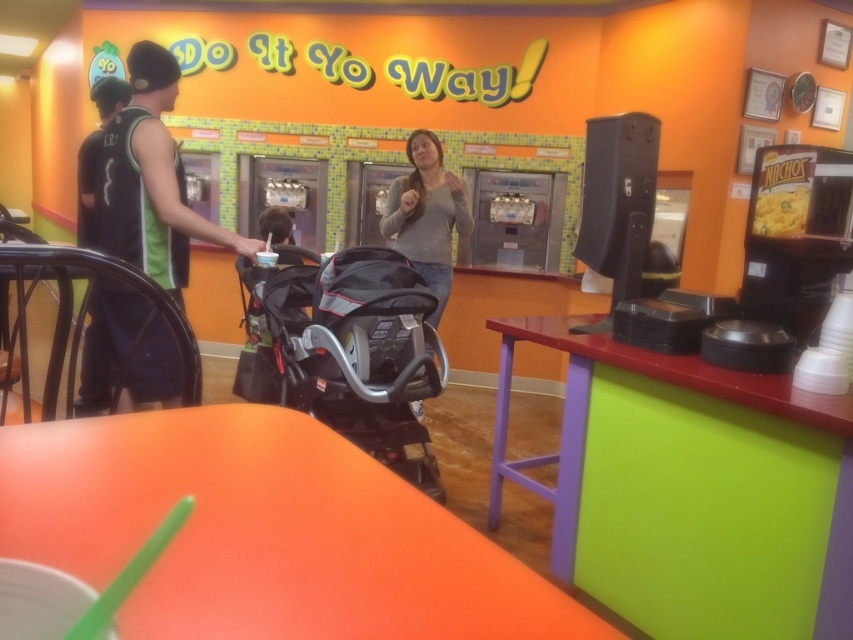
You are a painter who needs to hang a picture frame that is 1.5 meters tall on the wall. You observe the black textured stroller at center and the black sleeveless shirt at left in the scene. Which object is shorter than the picture frame?

The black textured stroller at center is not as tall as the black sleeveless shirt at left, so the stroller is shorter than the shirt. Since the picture frame is 1.5 meters tall, the stroller is shorter than the frame.

You are a customer in this fast food restaurant and you see the black sleeveless shirt at left. Where exactly is it located in the image?

The black sleeveless shirt at left is located at point coordinates of (151, 180).

You are a customer in the restaurant and you see two people wearing the black sleeveless shirt at left and the gray matte sweater at center. Which one is closer to you?

The black sleeveless shirt at left is closer to you because it is in front of the gray matte sweater at center.